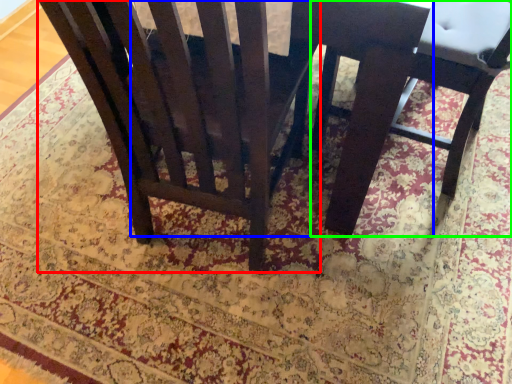
Question: Which object is positioned closest to chair (highlighted by a red box)? Select from round table (highlighted by a blue box) and chair (highlighted by a green box).

Choices:
 (A) round table
 (B) chair

Answer: (A)